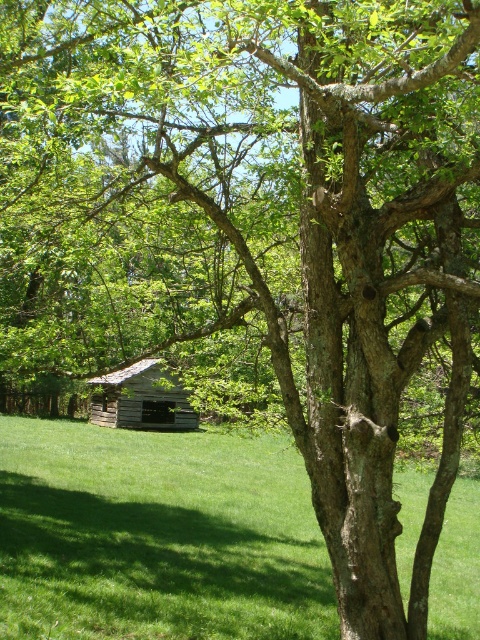
You are planning to set up a picnic area in the scene described. Given that the green grass at center and the weathered wood cabin at center are present, which location would provide more space for your picnic setup? Please explain your reasoning based on the objects in the scene.

The green grass at center is larger in size than the weathered wood cabin at center, so setting up the picnic at the green grass at center would provide more space for the setup.

Based on the photo, you are planning to set up a picnic blanket in the scene. The picnic blanket is 2 meters wide. Can the green grass at center accommodate the blanket without overlapping the weathered wood cabin at center?

The green grass at center has a larger width than the weathered wood cabin at center, so the picnic blanket can be placed on the green grass at center without overlapping the cabin.